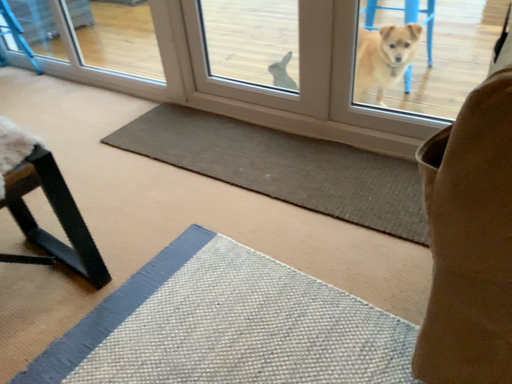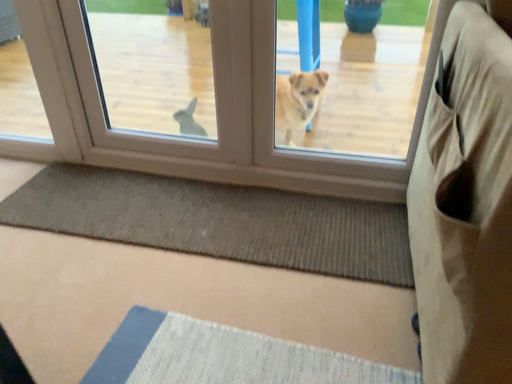
Question: Which way did the camera rotate in the video?

Choices:
 (A) rotated right
 (B) rotated left

Answer: (A)